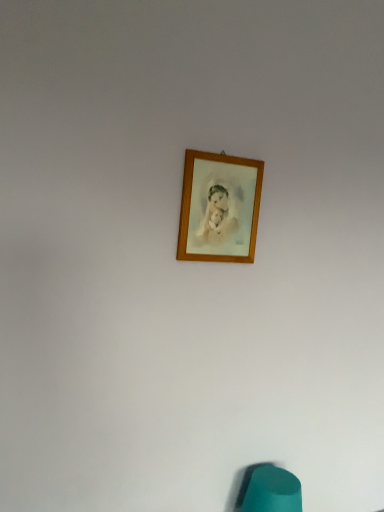
Question: Can you confirm if teal fabric bean bag chair at lower center is taller than wooden picture frame at upper center?

Choices:
 (A) yes
 (B) no

Answer: (B)

Question: From the image's perspective, does teal fabric bean bag chair at lower center appear lower than wooden picture frame at upper center?

Choices:
 (A) no
 (B) yes

Answer: (B)

Question: From a real-world perspective, is teal fabric bean bag chair at lower center positioned under wooden picture frame at upper center based on gravity?

Choices:
 (A) no
 (B) yes

Answer: (B)

Question: Is teal fabric bean bag chair at lower center closer to camera compared to wooden picture frame at upper center?

Choices:
 (A) yes
 (B) no

Answer: (B)

Question: Is teal fabric bean bag chair at lower center to the left of wooden picture frame at upper center from the viewer's perspective?

Choices:
 (A) yes
 (B) no

Answer: (B)

Question: Is teal fabric bean bag chair at lower center wider than wooden picture frame at upper center?

Choices:
 (A) yes
 (B) no

Answer: (A)

Question: Is wooden picture frame at upper center not inside teal fabric bean bag chair at lower center?

Choices:
 (A) yes
 (B) no

Answer: (A)

Question: Is there a large distance between wooden picture frame at upper center and teal fabric bean bag chair at lower center?

Choices:
 (A) yes
 (B) no

Answer: (B)

Question: Is wooden picture frame at upper center thinner than teal fabric bean bag chair at lower center?

Choices:
 (A) yes
 (B) no

Answer: (A)

Question: Does wooden picture frame at upper center contain teal fabric bean bag chair at lower center?

Choices:
 (A) yes
 (B) no

Answer: (B)

Question: From a real-world perspective, is wooden picture frame at upper center below teal fabric bean bag chair at lower center?

Choices:
 (A) no
 (B) yes

Answer: (A)

Question: Is wooden picture frame at upper center smaller than teal fabric bean bag chair at lower center?

Choices:
 (A) yes
 (B) no

Answer: (A)

Question: In terms of height, does wooden picture frame at upper center look taller or shorter compared to teal fabric bean bag chair at lower center?

Choices:
 (A) tall
 (B) short

Answer: (A)